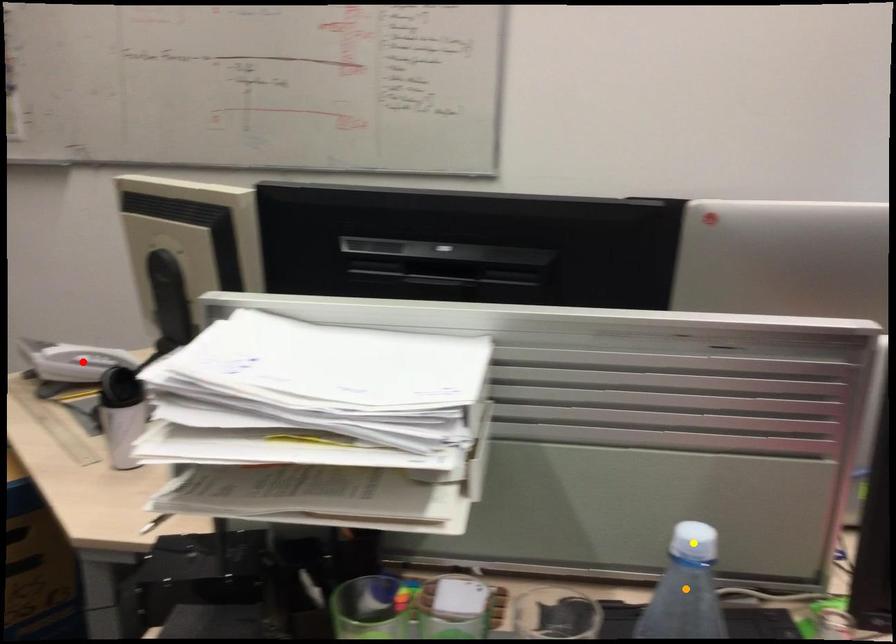
Based on the photo, order these from farthest to nearest:
1. red point
2. yellow point
3. orange point

1. red point
2. yellow point
3. orange point